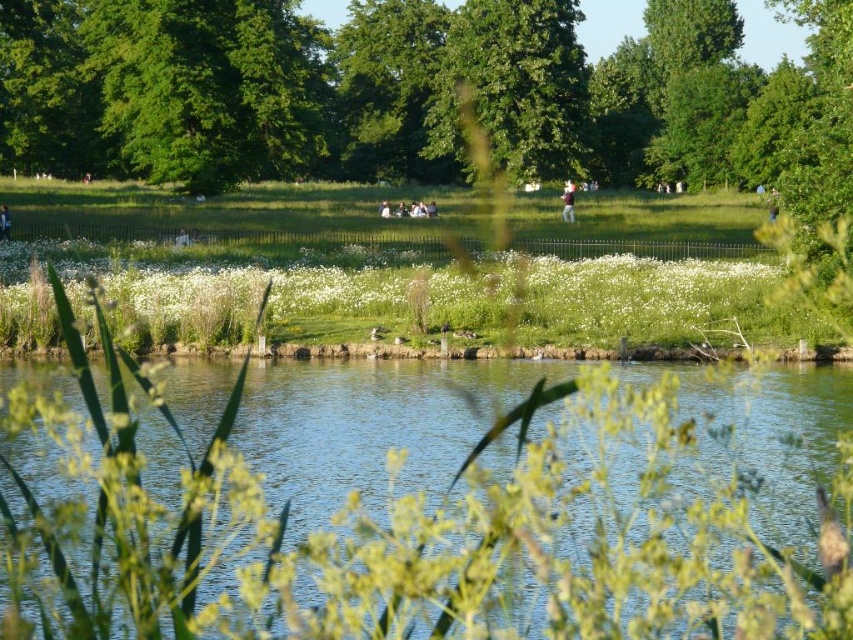
Is green grassy river at center bigger than green leafy tree at center?

Actually, green grassy river at center might be smaller than green leafy tree at center.

In the scene shown: Who is positioned more to the right, green grassy river at center or green leafy tree at center?

green leafy tree at center

What do you see at coordinates (431, 541) in the screenshot? The image size is (853, 640). I see `green grassy river at center` at bounding box center [431, 541].

Locate an element on the screen. This screenshot has width=853, height=640. green grassy river at center is located at coordinates (431, 541).

Looking at this image, is green leafy tree at center positioned before light brown fabric shirt at center?

No, it is behind light brown fabric shirt at center.

Find the location of a particular element. This screenshot has width=853, height=640. green leafy tree at center is located at coordinates (511, 88).

Is point (445, 93) in front of point (572, 188)?

That is False.

This screenshot has width=853, height=640. What are the coordinates of `green leafy tree at center` in the screenshot? It's located at (511, 88).

Which is more to the left, green grass at center or light brown wooden stick at lower left?

light brown wooden stick at lower left is more to the left.

Is green grass at center to the left of light brown wooden stick at lower left from the viewer's perspective?

In fact, green grass at center is to the right of light brown wooden stick at lower left.

Where is `green grass at center`? The width and height of the screenshot is (853, 640). green grass at center is located at coordinates (242, 214).